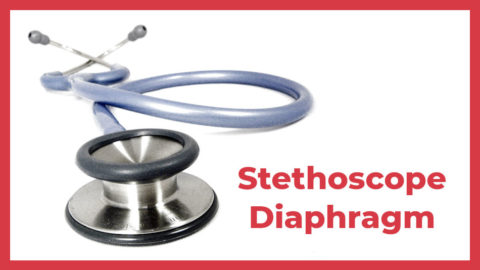
Where is `table`? This screenshot has height=270, width=480. table is located at coordinates (216, 164).